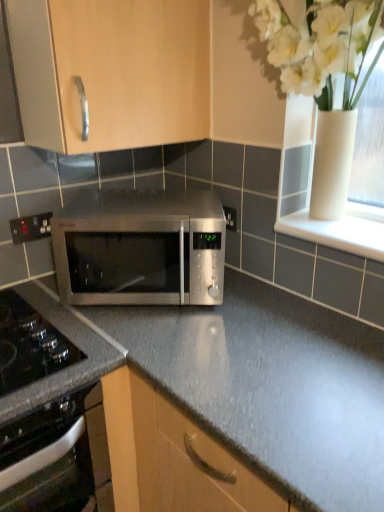
What do you see at coordinates (30, 227) in the screenshot?
I see `black plastic electrical outlet at lower left` at bounding box center [30, 227].

The width and height of the screenshot is (384, 512). What do you see at coordinates (58, 457) in the screenshot? I see `black glass oven at lower left` at bounding box center [58, 457].

Identify the location of white glossy window sill at upper right. (340, 229).

Considering the positions of objects white glossy vase at upper right and white glossy window sill at upper right in the image provided, who is more to the left, white glossy vase at upper right or white glossy window sill at upper right?

Positioned to the left is white glossy vase at upper right.

Which object is further away from the camera, white glossy vase at upper right or white glossy window sill at upper right?

white glossy window sill at upper right is more distant.

From the image's perspective, is white glossy vase at upper right below white glossy window sill at upper right?

No.

Looking at this image, from a real-world perspective, does white glossy vase at upper right stand above white glossy window sill at upper right?

Yes, from a real-world perspective, white glossy vase at upper right is on top of white glossy window sill at upper right.

Is black glass oven at lower left aimed at white glossy vase at upper right?

No.

Would you say black glass oven at lower left is a long distance from white glossy vase at upper right?

Indeed, black glass oven at lower left is not near white glossy vase at upper right.

Based on the photo, from a real-world perspective, is black glass oven at lower left physically located above or below white glossy vase at upper right?

black glass oven at lower left is situated lower than white glossy vase at upper right in the real world.

Considering their positions, is black glass oven at lower left located in front of or behind white glossy vase at upper right?

Visually, black glass oven at lower left is located behind white glossy vase at upper right.

Do you think matte wood cabinet at upper center is within white glossy window sill at upper right, or outside of it?

matte wood cabinet at upper center is spatially situated outside white glossy window sill at upper right.

Would you say matte wood cabinet at upper center is to the left or to the right of white glossy window sill at upper right in the picture?

Based on their positions, matte wood cabinet at upper center is located to the left of white glossy window sill at upper right.

Is point (104, 118) closer to viewer compared to point (368, 256)?

No, (104, 118) is behind (368, 256).

This screenshot has width=384, height=512. Find the location of `window sill on the right side of matte wood cabinet at upper center`. window sill on the right side of matte wood cabinet at upper center is located at coordinates (340, 229).

Does black plastic electrical outlet at lower left have a lesser height compared to stainless steel microwave at center?

Yes.

What's the angular difference between black plastic electrical outlet at lower left and stainless steel microwave at center's facing directions?

They differ by 42.4 degrees in their facing directions.

From a real-world perspective, which object stands above the other?

In real-world perspective, black plastic electrical outlet at lower left is above.

Does black plastic electrical outlet at lower left turn towards stainless steel microwave at center?

Yes, black plastic electrical outlet at lower left is facing stainless steel microwave at center.

How different are the orientations of stainless steel microwave at center and black plastic electrical outlet at lower left in degrees?

42.4 degrees separate the facing orientations of stainless steel microwave at center and black plastic electrical outlet at lower left.

Based on the photo, from the image's perspective, which object appears higher, stainless steel microwave at center or black plastic electrical outlet at lower left?

black plastic electrical outlet at lower left is shown above in the image.

Is stainless steel microwave at center taller than black plastic electrical outlet at lower left?

Correct, stainless steel microwave at center is much taller as black plastic electrical outlet at lower left.

At what (x,y) coordinates should I click in order to perform the action: click on electric outlet on the left of the stainless steel microwave at center. Please return your answer as a coordinate pair (x, y). The width and height of the screenshot is (384, 512). Looking at the image, I should click on (30, 227).

Would you say stainless steel microwave at center is outside black glass oven at lower left?

stainless steel microwave at center is positioned outside black glass oven at lower left.

Does stainless steel microwave at center have a lesser height compared to black glass oven at lower left?

Yes, stainless steel microwave at center is shorter than black glass oven at lower left.

From the image's perspective, which one is positioned lower, white glossy window sill at upper right or black glass oven at lower left?

black glass oven at lower left, from the image's perspective.

Can you confirm if white glossy window sill at upper right is bigger than black glass oven at lower left?

No.

Is black glass oven at lower left located within white glossy window sill at upper right?

Actually, black glass oven at lower left is outside white glossy window sill at upper right.

From a real-world perspective, which is physically below, white glossy window sill at upper right or black glass oven at lower left?

black glass oven at lower left.

Locate an element on the screen. This screenshot has height=512, width=384. floral arrangement on the left of white glossy window sill at upper right is located at coordinates (321, 45).

Identify the location of oven located behind the white glossy vase at upper right. (58, 457).

From the picture: Estimate the real-world distances between objects in this image. Which object is further from white glossy vase at upper right, stainless steel microwave at center or black glass oven at lower left?

Among the two, black glass oven at lower left is located further to white glossy vase at upper right.

Estimate the real-world distances between objects in this image. Which object is closer to white glossy vase at upper right, white glossy window sill at upper right or black plastic electrical outlet at lower left?

Among the two, white glossy window sill at upper right is located nearer to white glossy vase at upper right.

Considering their positions, is white glossy window sill at upper right positioned closer to black glass oven at lower left than matte wood cabinet at upper center?

matte wood cabinet at upper center lies closer to black glass oven at lower left than the other object.

Estimate the real-world distances between objects in this image. Which object is further from stainless steel microwave at center, white glossy vase at upper right or matte wood cabinet at upper center?

white glossy vase at upper right.

Which object lies nearer to the anchor point white glossy window sill at upper right, stainless steel microwave at center or white glossy vase at upper right?

white glossy vase at upper right is closer to white glossy window sill at upper right.

Consider the image. Based on their spatial positions, is black plastic electrical outlet at lower left or stainless steel microwave at center further from black glass oven at lower left?

black plastic electrical outlet at lower left.

Estimate the real-world distances between objects in this image. Which object is closer to matte wood cabinet at upper center, black glass oven at lower left or stainless steel microwave at center?

stainless steel microwave at center is positioned closer to the anchor matte wood cabinet at upper center.

From the image, which object appears to be nearer to white glossy vase at upper right, black plastic electrical outlet at lower left or matte wood cabinet at upper center?

Among the two, matte wood cabinet at upper center is located nearer to white glossy vase at upper right.

Locate an element on the screen. microwave oven located between matte wood cabinet at upper center and white glossy vase at upper right in the left-right direction is located at coordinates (140, 248).

I want to click on microwave oven between matte wood cabinet at upper center and white glossy window sill at upper right from left to right, so click(140, 248).

Locate an element on the screen. This screenshot has width=384, height=512. microwave oven between black glass oven at lower left and white glossy window sill at upper right in the horizontal direction is located at coordinates (140, 248).

Locate an element on the screen. The width and height of the screenshot is (384, 512). cabinetry between black plastic electrical outlet at lower left and white glossy vase at upper right in the horizontal direction is located at coordinates (111, 71).